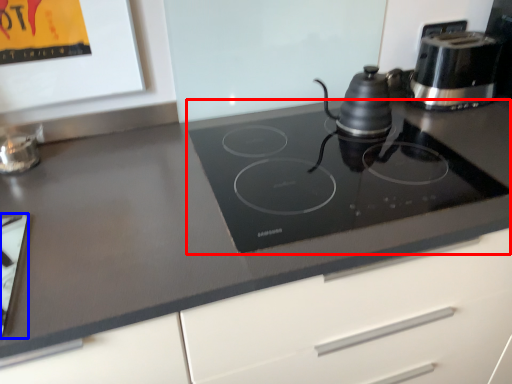
Question: Which object is further to the camera taking this photo, gas stove (highlighted by a red box) or appliance (highlighted by a blue box)?

Choices:
 (A) gas stove
 (B) appliance

Answer: (A)